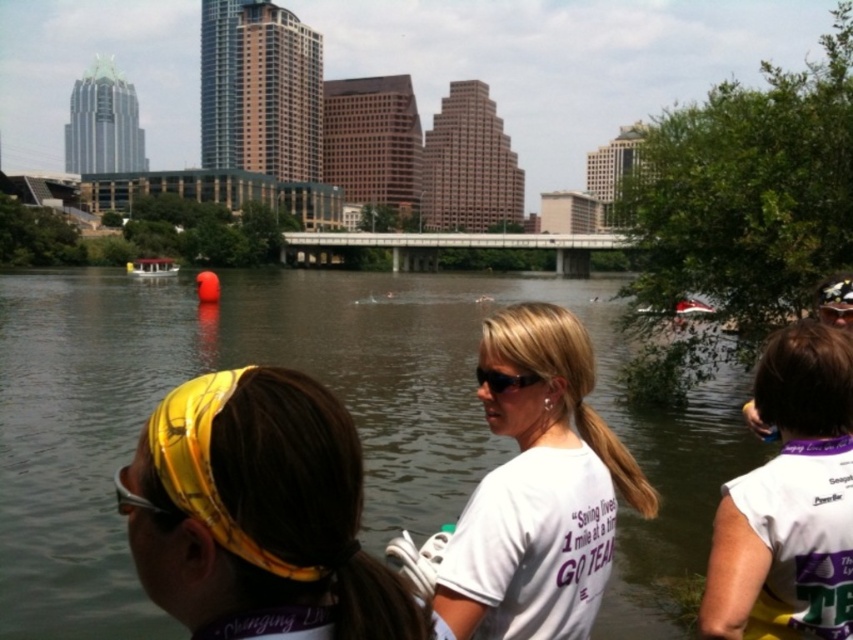
You are a photographer trying to capture a photo of the sunglasses at center and the white plastic boat at upper right in the image. Which object should you focus on first if you want to include both in your frame without moving the camera?

The sunglasses at center is positioned on the left side of white plastic boat at upper right, so you should focus on the sunglasses at center first to ensure both are in frame without moving the camera.

You are a photographer trying to capture the entire scene of the river and the city buildings in one shot. The greenish water at center and the yellow fabric headband at upper right are both in your current frame. Which object should you adjust your camera to focus on to ensure both are in focus?

The greenish water at center is much taller than the yellow fabric headband at upper right. To ensure both are in focus, focus on the greenish water at center since it is larger and occupies more of the frame.

You are a photographer trying to capture the greenish water at center and the yellow fabric headband at upper right in the same frame. Based on their positions, which object would appear closer to the camera in the photo?

The greenish water at center appears closer to the camera because it is positioned in front of the yellow fabric headband at upper right.